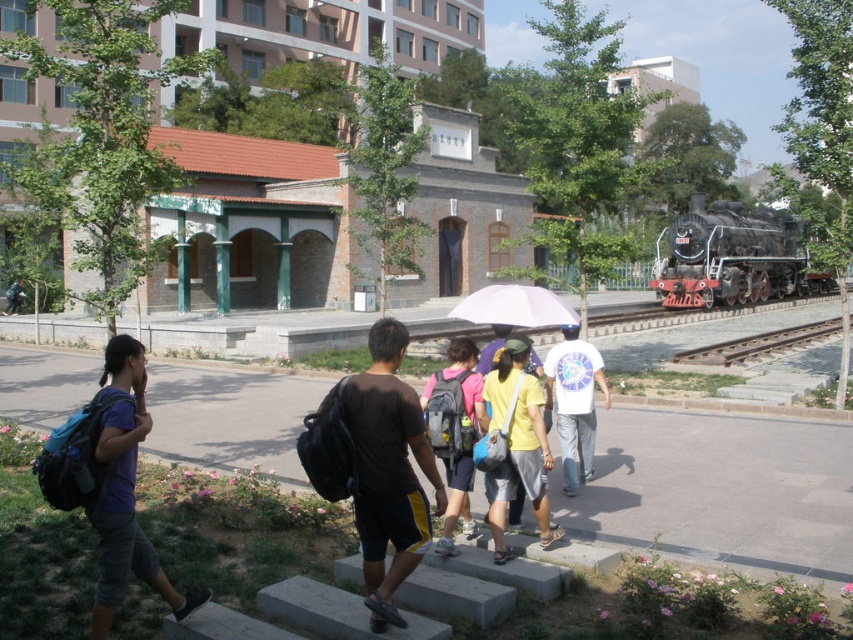
Can you confirm if gray concrete stairs at lower center is taller than yellow matte shirt at center?

No, gray concrete stairs at lower center is not taller than yellow matte shirt at center.

Between gray concrete stairs at lower center and yellow matte shirt at center, which one has less height?

gray concrete stairs at lower center is shorter.

Does point (482, 618) come closer to viewer compared to point (506, 465)?

That is True.

Where is `gray concrete stairs at lower center`? The width and height of the screenshot is (853, 640). gray concrete stairs at lower center is located at coordinates (502, 589).

Is black matte backpack at center positioned behind blue backpack at left?

Yes, black matte backpack at center is further from the viewer.

Is point (374, 568) closer to viewer compared to point (108, 627)?

No.

Find the location of a particular element. Image resolution: width=853 pixels, height=640 pixels. black matte backpack at center is located at coordinates (387, 468).

Which is in front, point (521, 461) or point (462, 483)?

Positioned in front is point (521, 461).

Which of these two, yellow matte shirt at center or matte pink backpack at center, stands shorter?

With less height is matte pink backpack at center.

Where is `yellow matte shirt at center`? yellow matte shirt at center is located at coordinates (517, 444).

Locate an element on the screen. yellow matte shirt at center is located at coordinates (517, 444).